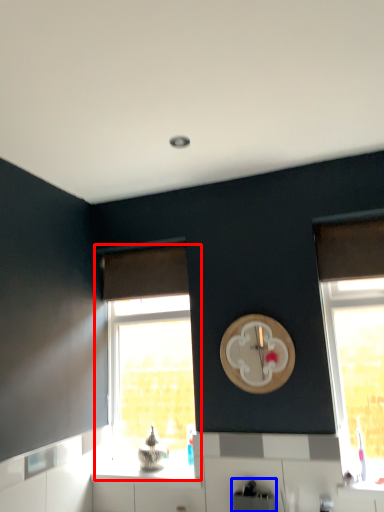
Question: Among these objects, which one is nearest to the camera, window (highlighted by a red box) or appliance (highlighted by a blue box)?

Choices:
 (A) window
 (B) appliance

Answer: (B)